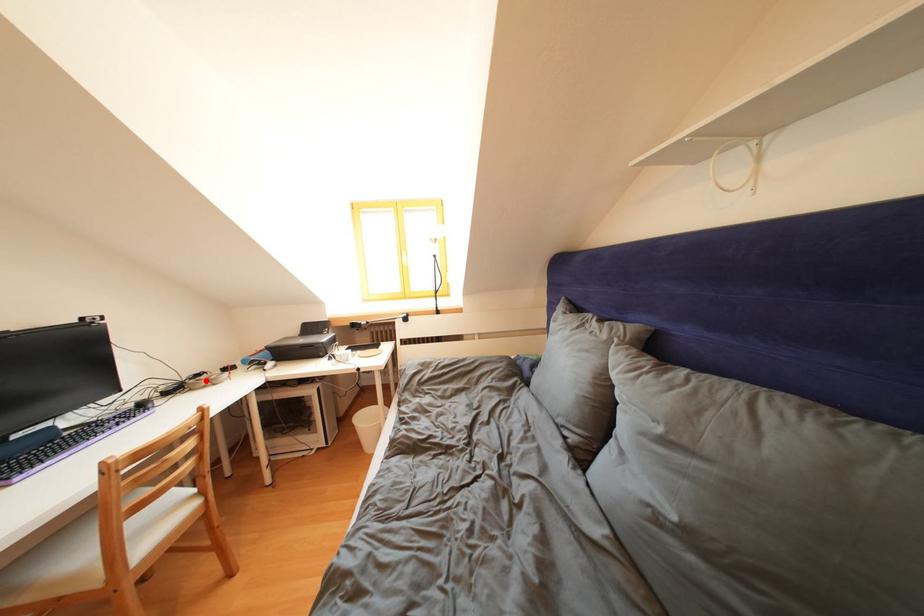
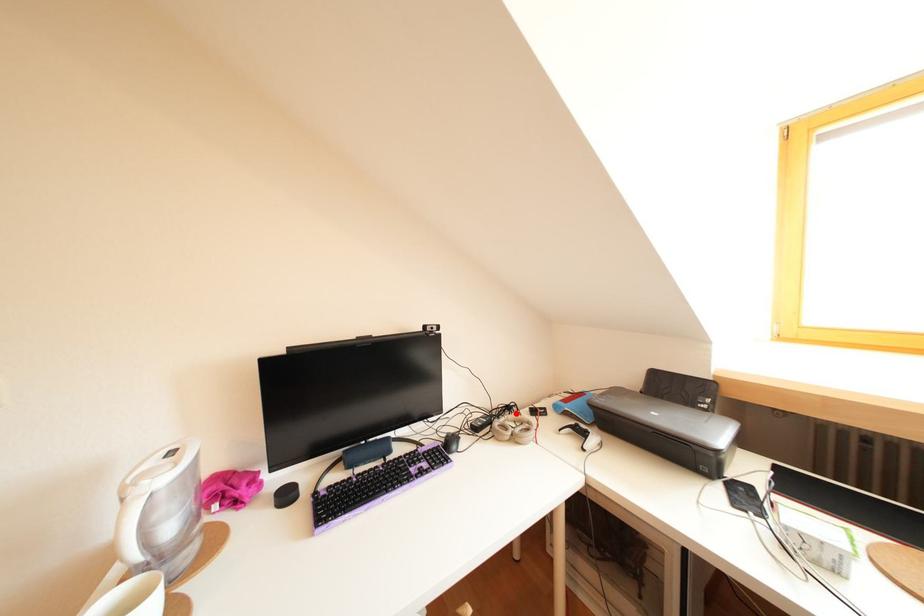
I am providing you with two images of the same scene from different viewpoints. A red point is marked on the first image and another point is marked on the second image. Do the highlighted points in image1 and image2 indicate the same real-world spot?

Yes